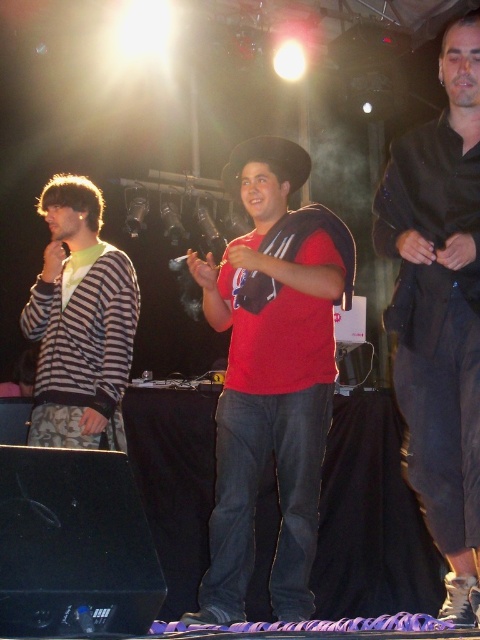
Is red matte shirt at center below striped knit cardigan at left?

Yes, red matte shirt at center is below striped knit cardigan at left.

Is point (260, 412) positioned before point (99, 337)?

Yes, point (260, 412) is in front of point (99, 337).

Does point (250, 429) come behind point (71, 410)?

No, it is in front of (71, 410).

Identify the location of red matte shirt at center. (268, 387).

Can you confirm if red matte shirt at center is thinner than black satin suit at right?

No, red matte shirt at center is not thinner than black satin suit at right.

Is red matte shirt at center below black satin suit at right?

Yes.

Where is `red matte shirt at center`? The width and height of the screenshot is (480, 640). red matte shirt at center is located at coordinates (268, 387).

Locate an element on the screen. This screenshot has height=640, width=480. red matte shirt at center is located at coordinates [268, 387].

How much distance is there between black satin suit at right and striped knit cardigan at left?

black satin suit at right is 4.06 feet from striped knit cardigan at left.

Can you confirm if black satin suit at right is smaller than striped knit cardigan at left?

Yes, black satin suit at right is smaller than striped knit cardigan at left.

This screenshot has width=480, height=640. I want to click on black satin suit at right, so coord(441,308).